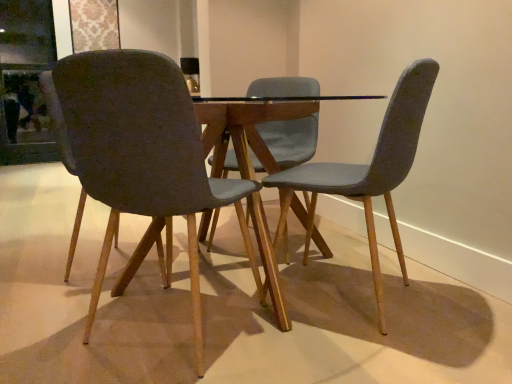
Question: From the image's perspective, would you say textured gray chair at left, which is the 2th chair in right-to-left order, is shown under transparent glass door at upper left?

Choices:
 (A) no
 (B) yes

Answer: (B)

Question: Is textured gray chair at left, which is the first chair from left to right, thinner than transparent glass door at upper left?

Choices:
 (A) no
 (B) yes

Answer: (A)

Question: Is textured gray chair at left, which is the first chair from left to right, at the right side of transparent glass door at upper left?

Choices:
 (A) no
 (B) yes

Answer: (B)

Question: Does textured gray chair at left, which is the 2th chair in right-to-left order, come in front of transparent glass door at upper left?

Choices:
 (A) no
 (B) yes

Answer: (B)

Question: Considering the relative sizes of textured gray chair at left, which is the first chair from left to right, and transparent glass door at upper left in the image provided, is textured gray chair at left, which is the first chair from left to right, taller than transparent glass door at upper left?

Choices:
 (A) no
 (B) yes

Answer: (A)

Question: Considering the positions of textured gray chair at center, the second chair when ordered from left to right, and textured gray chair at left, which is the first chair from left to right, in the image, is textured gray chair at center, the second chair when ordered from left to right, taller or shorter than textured gray chair at left, which is the first chair from left to right,?

Choices:
 (A) tall
 (B) short

Answer: (A)

Question: Is textured gray chair at center, the second chair when ordered from left to right, spatially inside textured gray chair at left, which is the first chair from left to right, or outside of it?

Choices:
 (A) inside
 (B) outside

Answer: (B)

Question: Would you say textured gray chair at center, which ranks as the 1th chair in right-to-left order, is to the left or to the right of textured gray chair at left, which is the 2th chair in right-to-left order, in the picture?

Choices:
 (A) left
 (B) right

Answer: (B)

Question: Considering the positions of textured gray chair at center, which ranks as the 1th chair in right-to-left order, and textured gray chair at left, which is the first chair from left to right, in the image, is textured gray chair at center, which ranks as the 1th chair in right-to-left order, bigger or smaller than textured gray chair at left, which is the first chair from left to right,?

Choices:
 (A) big
 (B) small

Answer: (A)

Question: Considering the relative positions of textured gray chair at left, which is the first chair from left to right, and textured gray chair at center, which ranks as the 1th chair in right-to-left order, in the image provided, is textured gray chair at left, which is the first chair from left to right, to the left or to the right of textured gray chair at center, which ranks as the 1th chair in right-to-left order,?

Choices:
 (A) left
 (B) right

Answer: (A)

Question: In terms of height, does textured gray chair at left, which is the first chair from left to right, look taller or shorter compared to textured gray chair at center, which ranks as the 1th chair in right-to-left order?

Choices:
 (A) tall
 (B) short

Answer: (B)

Question: Does point (113, 193) appear closer or farther from the camera than point (395, 115)?

Choices:
 (A) farther
 (B) closer

Answer: (B)

Question: From the image's perspective, is textured gray chair at left, which is the first chair from left to right, positioned above or below textured gray chair at center, the second chair when ordered from left to right?

Choices:
 (A) below
 (B) above

Answer: (A)

Question: In terms of width, does transparent glass door at upper left look wider or thinner when compared to textured gray chair at center, the second chair when ordered from left to right?

Choices:
 (A) thin
 (B) wide

Answer: (A)

Question: In terms of height, does transparent glass door at upper left look taller or shorter compared to textured gray chair at center, the second chair when ordered from left to right?

Choices:
 (A) short
 (B) tall

Answer: (B)